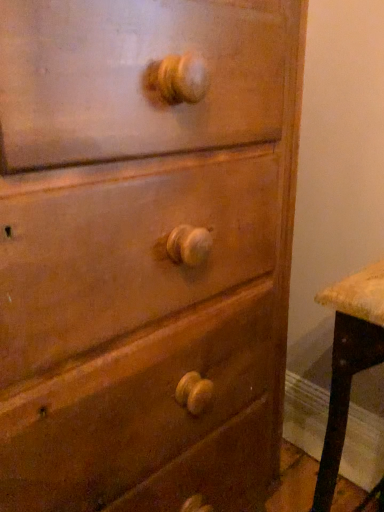
Identify the location of wooden stool at right. (349, 362).

What do you see at coordinates (349, 362) in the screenshot? The height and width of the screenshot is (512, 384). I see `wooden stool at right` at bounding box center [349, 362].

Locate an element on the screen. This screenshot has height=512, width=384. wooden stool at right is located at coordinates (349, 362).